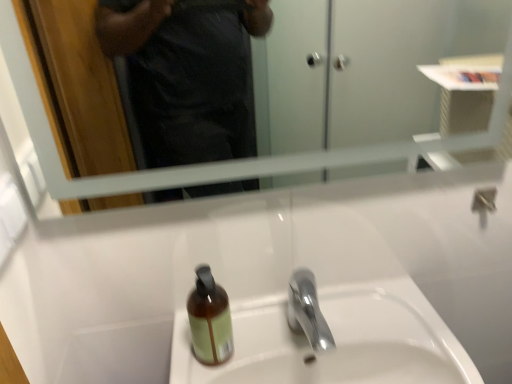
What do you see at coordinates (233, 160) in the screenshot?
I see `clear glass mirror at upper center` at bounding box center [233, 160].

Image resolution: width=512 pixels, height=384 pixels. I want to click on brown glass bottle at center, so click(210, 319).

The width and height of the screenshot is (512, 384). What do you see at coordinates (333, 341) in the screenshot? I see `white ceramic sink at center` at bounding box center [333, 341].

Describe the element at coordinates (307, 311) in the screenshot. I see `polished chrome faucet at center` at that location.

Measure the distance between point (327, 344) and camera.

Point (327, 344) and camera are 67.60 centimeters apart from each other.

Identify the location of clear glass mirror at upper center. The width and height of the screenshot is (512, 384). (233, 160).

From the image's perspective, is brown glass bottle at center above or below polished chrome faucet at center?

Clearly, from the image's perspective, brown glass bottle at center is above polished chrome faucet at center.

Can you confirm if brown glass bottle at center is wider than polished chrome faucet at center?

No.

Does point (222, 293) appear closer or farther from the camera than point (322, 324)?

Point (222, 293).

What's the angular difference between brown glass bottle at center and polished chrome faucet at center's facing directions?

The angular difference between brown glass bottle at center and polished chrome faucet at center is 3.72e-05 degrees.

Could you tell me if polished chrome faucet at center is facing brown glass bottle at center?

No, polished chrome faucet at center is not oriented towards brown glass bottle at center.

In the scene shown: In the image, is polished chrome faucet at center positioned in front of or behind brown glass bottle at center?

polished chrome faucet at center is positioned closer to the viewer than brown glass bottle at center.

Is point (329, 330) closer or farther from the camera than point (209, 306)?

Point (329, 330).

In order to click on bottle on the left of polished chrome faucet at center in this screenshot , I will do `click(210, 319)`.

How different are the orientations of polished chrome faucet at center and white ceramic sink at center in degrees?

4.4e-05 degrees.

From a real-world perspective, is polished chrome faucet at center positioned above or below white ceramic sink at center?

Clearly, from a real-world perspective, polished chrome faucet at center is above white ceramic sink at center.

Is polished chrome faucet at center thinner than white ceramic sink at center?

Correct, the width of polished chrome faucet at center is less than that of white ceramic sink at center.

Consider the image. From the image's perspective, which object appears higher, polished chrome faucet at center or white ceramic sink at center?

From the image's view, polished chrome faucet at center is above.

Could you tell me if white ceramic sink at center is turned towards brown glass bottle at center?

No.

Can you confirm if white ceramic sink at center is wider than brown glass bottle at center?

Yes.

From a real-world perspective, is white ceramic sink at center above or below brown glass bottle at center?

From a real-world perspective, white ceramic sink at center is physically below brown glass bottle at center.

Is brown glass bottle at center next to clear glass mirror at upper center and touching it?

brown glass bottle at center and clear glass mirror at upper center are not in contact.

From a real-world perspective, is brown glass bottle at center located beneath clear glass mirror at upper center?

Yes, from a real-world perspective, brown glass bottle at center is below clear glass mirror at upper center.

Which object is wider, brown glass bottle at center or clear glass mirror at upper center?

With larger width is brown glass bottle at center.

Which of these two, clear glass mirror at upper center or brown glass bottle at center, is bigger?

clear glass mirror at upper center.

Can you see clear glass mirror at upper center touching brown glass bottle at center?

No, clear glass mirror at upper center is not next to brown glass bottle at center.

Which object is positioned more to the left, clear glass mirror at upper center or brown glass bottle at center?

brown glass bottle at center is more to the left.

Which is behind, brown glass bottle at center or white ceramic sink at center?

brown glass bottle at center is behind.

The image size is (512, 384). In order to click on sink that is on the right side of brown glass bottle at center in this screenshot , I will do `click(333, 341)`.

Is brown glass bottle at center with white ceramic sink at center?

No, brown glass bottle at center is not making contact with white ceramic sink at center.

Where is `bottle that is above the polished chrome faucet at center (from a real-world perspective)`? bottle that is above the polished chrome faucet at center (from a real-world perspective) is located at coordinates (210, 319).

You are a GUI agent. You are given a task and a screenshot of the screen. Output one action in this format:
    pyautogui.click(x=<x>, y=<y>)
    Task: Click on the tap below the brown glass bottle at center (from a real-world perspective)
    
    Given the screenshot: What is the action you would take?
    pyautogui.click(x=307, y=311)

Based on their spatial positions, is polished chrome faucet at center or brown glass bottle at center further from white ceramic sink at center?

Based on the image, brown glass bottle at center appears to be further to white ceramic sink at center.

When comparing their distances from brown glass bottle at center, does polished chrome faucet at center or clear glass mirror at upper center seem closer?

polished chrome faucet at center is closer to brown glass bottle at center.

Estimate the real-world distances between objects in this image. Which object is further from clear glass mirror at upper center, brown glass bottle at center or white ceramic sink at center?

white ceramic sink at center.

When comparing their distances from clear glass mirror at upper center, does polished chrome faucet at center or white ceramic sink at center seem further?

polished chrome faucet at center is positioned further to the anchor clear glass mirror at upper center.

Looking at the image, which one is located further to brown glass bottle at center, clear glass mirror at upper center or white ceramic sink at center?

clear glass mirror at upper center lies further to brown glass bottle at center than the other object.

Considering their positions, is clear glass mirror at upper center positioned closer to white ceramic sink at center than polished chrome faucet at center?

The object closer to white ceramic sink at center is polished chrome faucet at center.

Considering their positions, is polished chrome faucet at center positioned further to clear glass mirror at upper center than brown glass bottle at center?

polished chrome faucet at center.

From the image, which object appears to be farther from brown glass bottle at center, white ceramic sink at center or polished chrome faucet at center?

white ceramic sink at center is positioned further to the anchor brown glass bottle at center.

Identify the location of bottle between clear glass mirror at upper center and polished chrome faucet at center vertically. The image size is (512, 384). (210, 319).

Identify the location of bottle between clear glass mirror at upper center and white ceramic sink at center vertically. (210, 319).

The height and width of the screenshot is (384, 512). Identify the location of tap between brown glass bottle at center and white ceramic sink at center. (307, 311).

In order to click on tap between clear glass mirror at upper center and white ceramic sink at center in the up-down direction in this screenshot , I will do `click(307, 311)`.